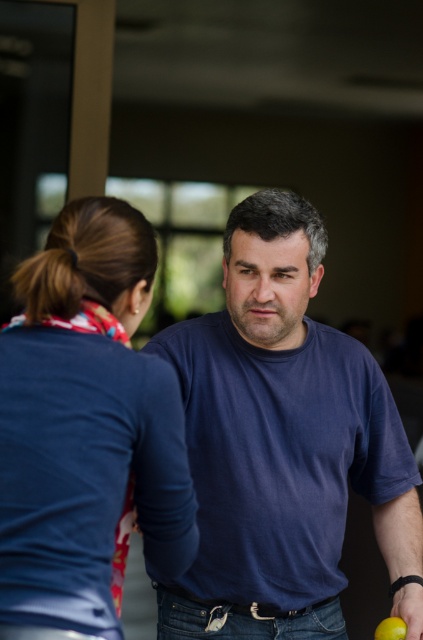
Question: Which object is the farthest from the dark blue t-shirt at center?

Choices:
 (A) green matte lime at lower right
 (B) blue fabric shirt at upper left

Answer: (A)

Question: Which object is positioned farthest from the blue fabric shirt at upper left?

Choices:
 (A) green matte lime at lower right
 (B) dark blue t-shirt at center

Answer: (A)

Question: Is dark blue t-shirt at center thinner than blue fabric shirt at upper left?

Choices:
 (A) no
 (B) yes

Answer: (A)

Question: Is dark blue t-shirt at center above green matte lime at lower right?

Choices:
 (A) no
 (B) yes

Answer: (B)

Question: Is dark blue t-shirt at center below blue fabric shirt at upper left?

Choices:
 (A) yes
 (B) no

Answer: (A)

Question: Which is nearer to the dark blue t-shirt at center?

Choices:
 (A) blue fabric shirt at upper left
 (B) green matte lime at lower right

Answer: (A)